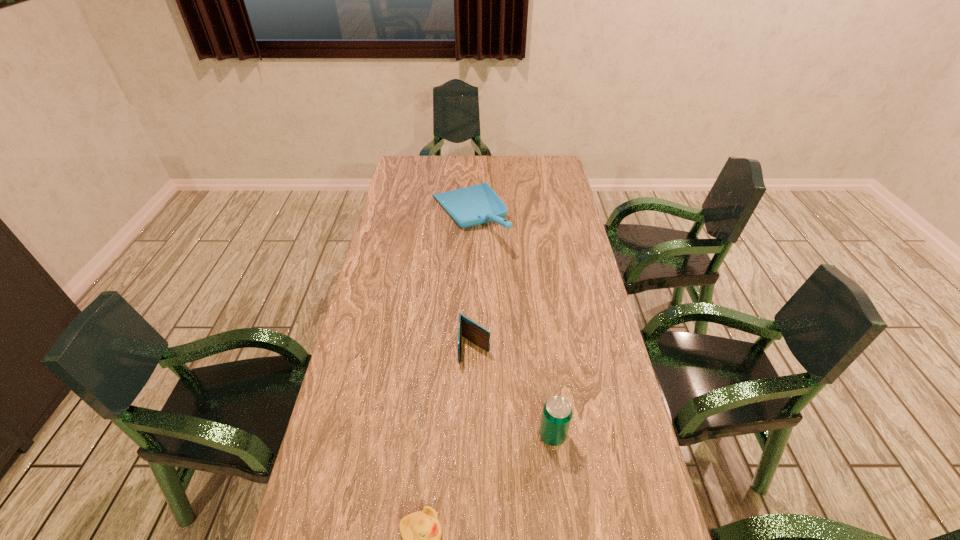
This screenshot has width=960, height=540. I want to click on vacant space that satisfies the following two spatial constraints: 1. on the exterior surface of the third nearest object; 2. on the left side of the rightmost object, so click(473, 435).